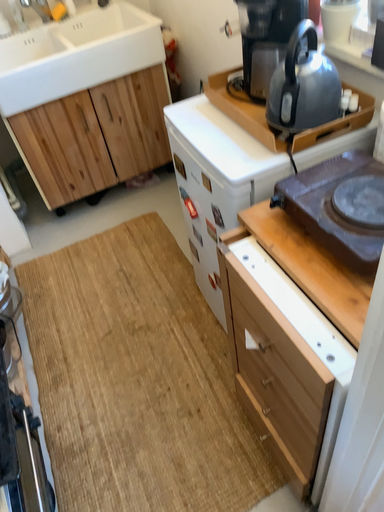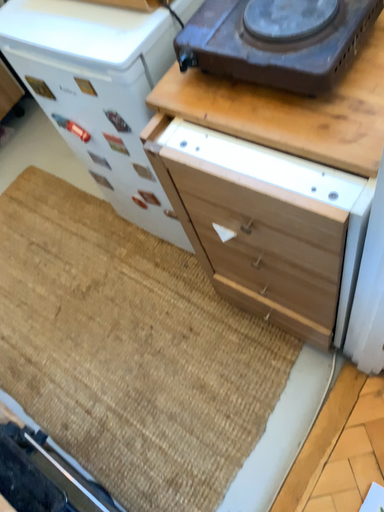
Question: Which way did the camera rotate in the video?

Choices:
 (A) rotated downward
 (B) rotated upward

Answer: (A)